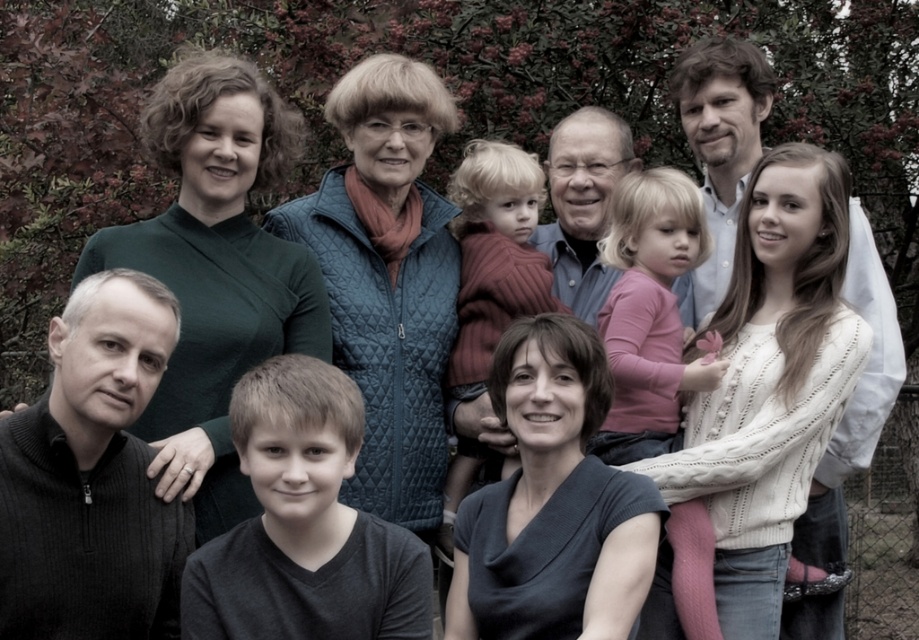
You are standing in front of the family photo taken in autumn. You notice two points marked on the image at coordinates point (623, 282) and point (467, 308). Based on their positions, which point is closer to you?

Point (623, 282) is in front of point (467, 308), so it is closer to you.

You are a photographer reviewing this family photo. You notice two sweaters at the center of the image, a pink sweater at center and a maroon knitted sweater at center. Which sweater is covering part of the other?

The pink sweater at center is positioned over the maroon knitted sweater at center, so it is covering part of it.